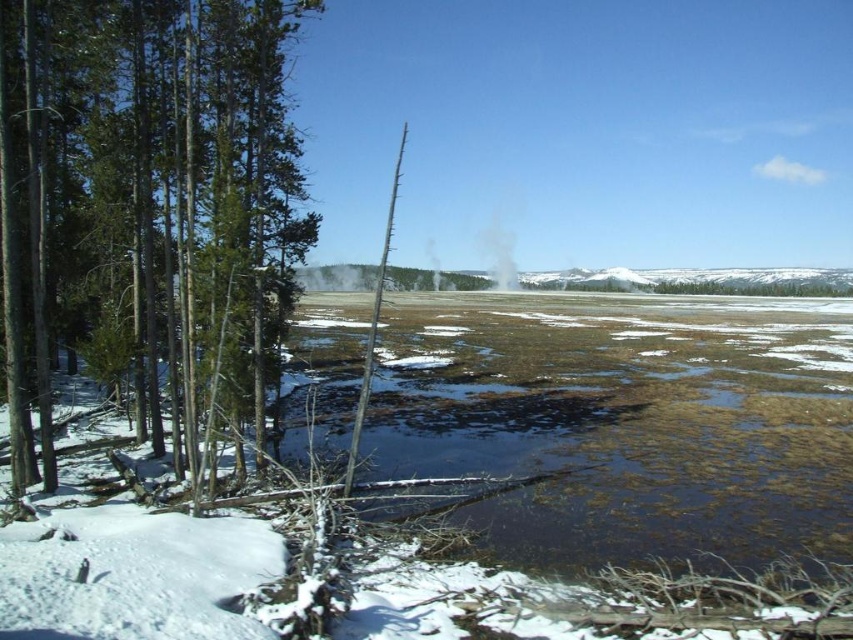
Question: Among these objects, which one is farthest from the camera?

Choices:
 (A) brown murky water at center
 (B) white translucent steam at center

Answer: (B)

Question: Where is brown murky water at center located in relation to white translucent steam at center in the image?

Choices:
 (A) below
 (B) above

Answer: (A)

Question: Which object appears farthest from the camera in this image?

Choices:
 (A) white translucent steam at center
 (B) brown murky water at center
 (C) green matte tree at left

Answer: (A)

Question: Which object appears closest to the camera in this image?

Choices:
 (A) white translucent steam at center
 (B) green matte tree at left

Answer: (B)

Question: Does brown murky water at center have a larger size compared to green matte tree at left?

Choices:
 (A) yes
 (B) no

Answer: (A)

Question: Does green matte tree at left come in front of white translucent steam at center?

Choices:
 (A) no
 (B) yes

Answer: (B)